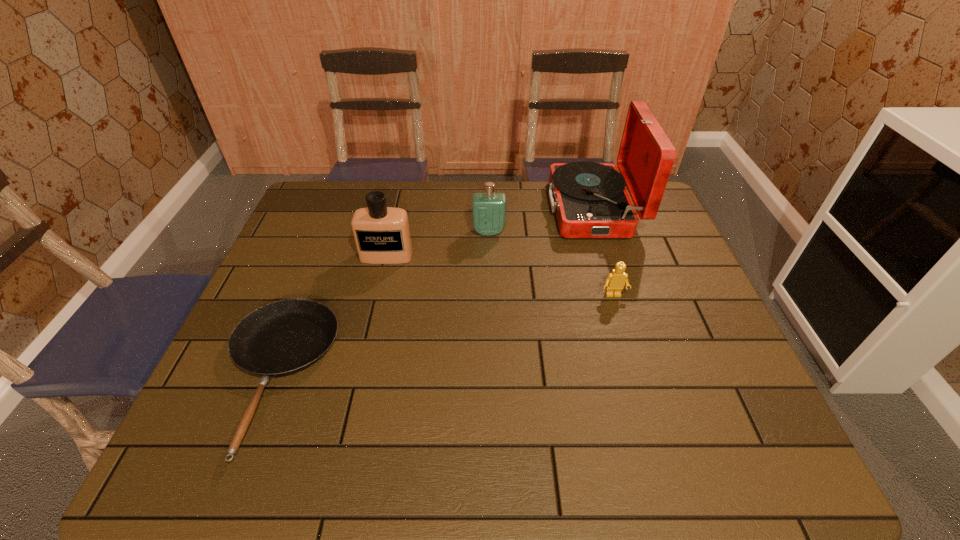
The image size is (960, 540). I want to click on free area in between the Lego and the tallest object, so click(x=603, y=252).

You are a GUI agent. You are given a task and a screenshot of the screen. Output one action in this format:
    pyautogui.click(x=<x>, y=<y>)
    Task: Click on the free space between the phonograph_record and the shortest object
    This screenshot has width=960, height=540.
    Given the screenshot: What is the action you would take?
    pyautogui.click(x=434, y=293)

Identify which object is located as the fourth nearest to the fourth shortest object. Please provide its 2D coordinates. Your answer should be formatted as a tuple, i.e. [(x, y)], where the tuple contains the x and y coordinates of a point satisfying the conditions above.

[(615, 281)]

Select which object is the third closest to the fourth tallest object. Please provide its 2D coordinates. Your answer should be formatted as a tuple, i.e. [(x, y)], where the tuple contains the x and y coordinates of a point satisfying the conditions above.

[(382, 235)]

What are the coordinates of `free region that satisfies the following two spatial constraints: 1. on the front-facing side of the phonograph_record; 2. on the front label of the taller perfume` in the screenshot? It's located at (607, 256).